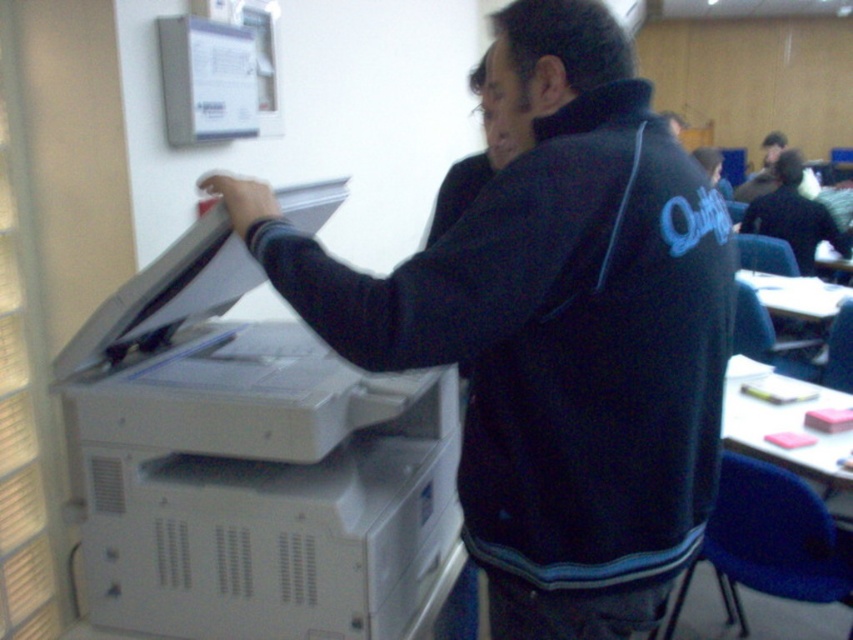
What do you see at coordinates (554, 328) in the screenshot? I see `black matte jacket at center` at bounding box center [554, 328].

Does point (717, 312) come farther from viewer compared to point (296, 536)?

No, (717, 312) is in front of (296, 536).

Where is `black matte jacket at center`? Image resolution: width=853 pixels, height=640 pixels. black matte jacket at center is located at coordinates (554, 328).

Measure the distance from white plastic printer at left to white paper at upper center.

They are 27.79 inches apart.

Does white plastic printer at left appear under white paper at upper center?

Indeed, white plastic printer at left is positioned under white paper at upper center.

Between point (105, 419) and point (225, 122), which one is positioned behind?

Positioned behind is point (225, 122).

At what (x,y) coordinates should I click in order to perform the action: click on white plastic printer at left. Please return your answer as a coordinate pair (x, y). The image size is (853, 640). Looking at the image, I should click on (247, 464).

Which is above, black matte jacket at center or white paper at upper center?

white paper at upper center is above.

Looking at this image, who is shorter, black matte jacket at center or white paper at upper center?

With less height is white paper at upper center.

Is point (598, 24) farther from viewer compared to point (221, 81)?

No, it is in front of (221, 81).

The height and width of the screenshot is (640, 853). In order to click on black matte jacket at center in this screenshot , I will do `click(554, 328)`.